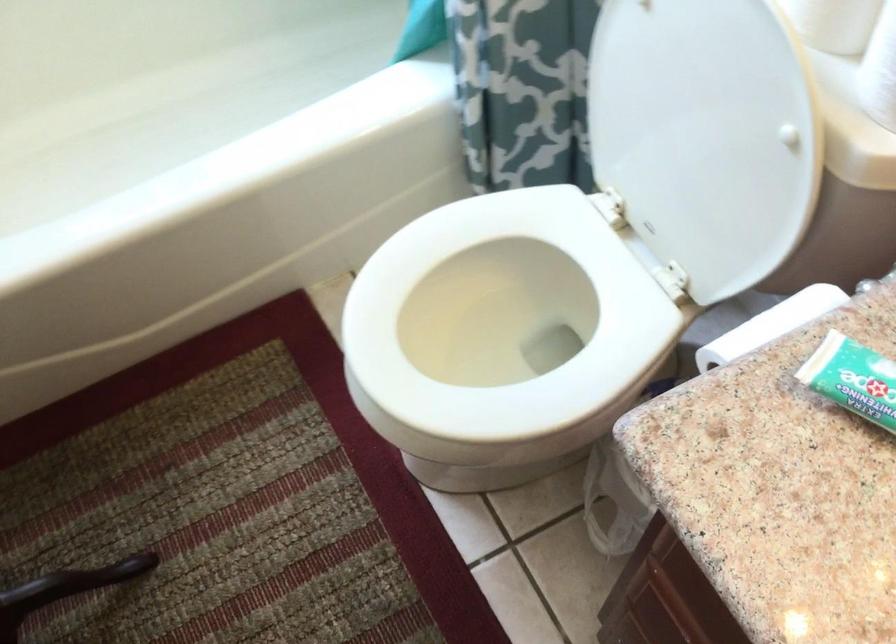
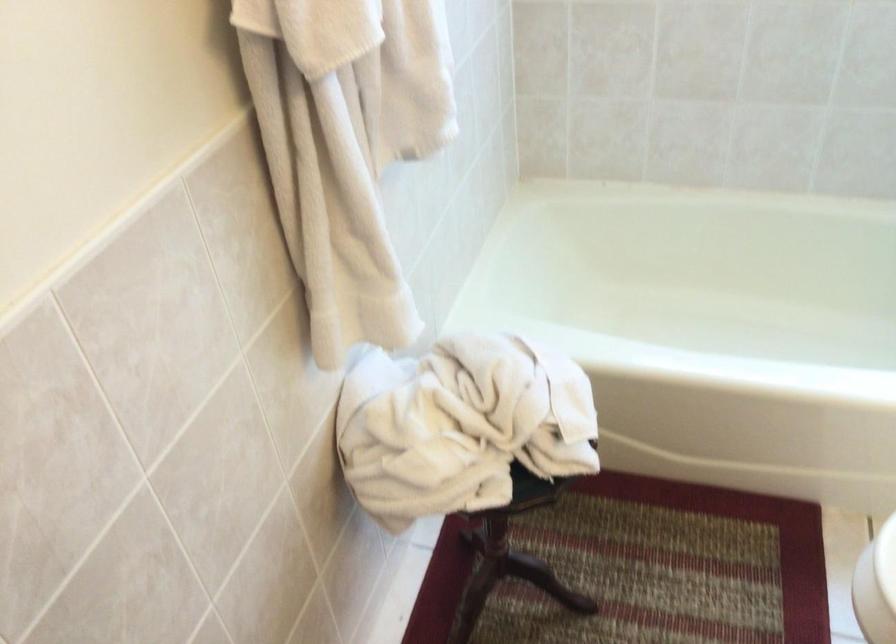
Question: The camera is either moving clockwise (left) or counter-clockwise (right) around the object. The first image is from the beginning of the video and the second image is from the end. Is the camera moving left or right when shooting the video?

Choices:
 (A) Left
 (B) Right

Answer: (B)